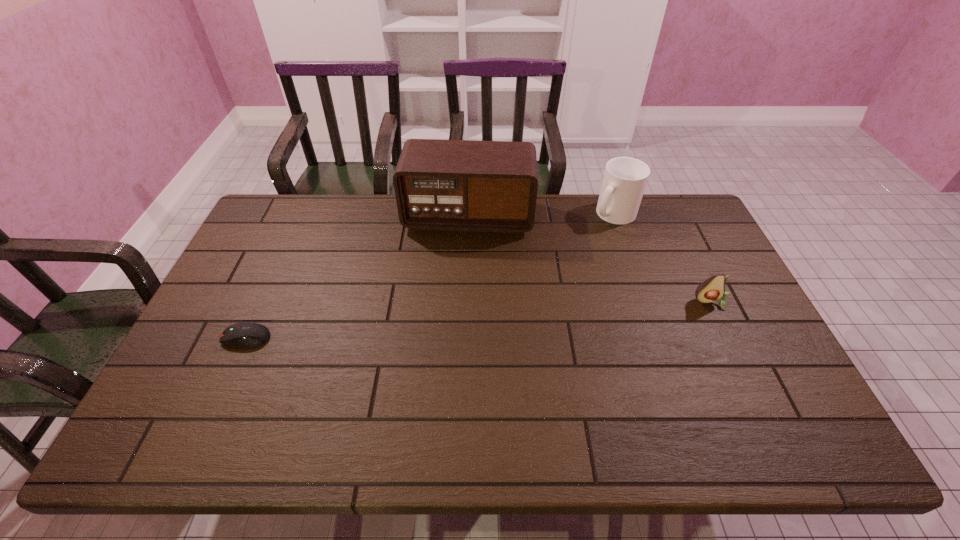
In order to click on free space at the near edge of the desktop in this screenshot , I will do `click(644, 392)`.

Locate an element on the screen. This screenshot has height=540, width=960. vacant space at the left edge of the desktop is located at coordinates (245, 272).

Image resolution: width=960 pixels, height=540 pixels. In order to click on free space at the right edge of the desktop in this screenshot , I will do `click(708, 324)`.

This screenshot has width=960, height=540. Find the location of `blank area at the far left corner`. blank area at the far left corner is located at coordinates (254, 230).

Where is `vacant space at the near right corner`? This screenshot has height=540, width=960. vacant space at the near right corner is located at coordinates (763, 390).

At what (x,y) coordinates should I click in order to perform the action: click on empty space between the leftmost object and the second tallest object. Please return your answer as a coordinate pair (x, y). Looking at the image, I should click on (430, 276).

In order to click on empty location between the shortest object and the radio receiver in this screenshot , I will do `click(357, 277)`.

This screenshot has height=540, width=960. In order to click on vacant area that lies between the tallest object and the second shortest object in this screenshot , I will do (590, 259).

You are a GUI agent. You are given a task and a screenshot of the screen. Output one action in this format:
    pyautogui.click(x=<x>, y=<y>)
    Task: Click on the free space between the radio receiver and the nearest object
    Image resolution: width=960 pixels, height=540 pixels.
    Given the screenshot: What is the action you would take?
    pyautogui.click(x=357, y=277)

What are the coordinates of `vacant area that lies between the computer equipment and the mug` in the screenshot? It's located at (430, 276).